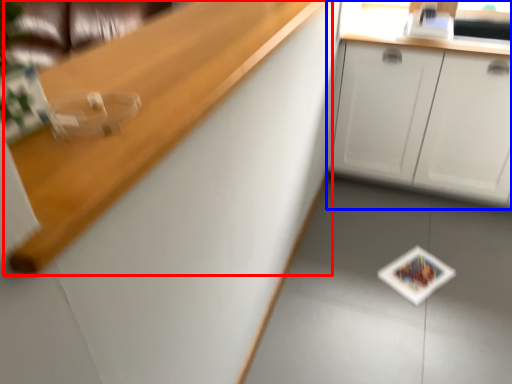
Question: Among these objects, which one is farthest to the camera, counter top (highlighted by a red box) or cabinetry (highlighted by a blue box)?

Choices:
 (A) counter top
 (B) cabinetry

Answer: (B)